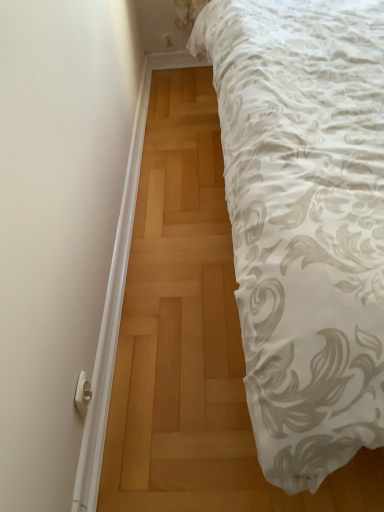
Question: Would you say white plastic door handle at lower left is to the left or to the right of white floral fabric at upper right in the picture?

Choices:
 (A) right
 (B) left

Answer: (B)

Question: Considering the positions of point (84, 391) and point (233, 182), is point (84, 391) closer or farther from the camera than point (233, 182)?

Choices:
 (A) closer
 (B) farther

Answer: (B)

Question: Relative to white floral fabric at upper right, is white plastic door handle at lower left in front or behind?

Choices:
 (A) behind
 (B) front

Answer: (A)

Question: Based on their sizes in the image, would you say white floral fabric at upper right is bigger or smaller than white plastic door handle at lower left?

Choices:
 (A) small
 (B) big

Answer: (B)

Question: Is white floral fabric at upper right in front of or behind white plastic door handle at lower left in the image?

Choices:
 (A) front
 (B) behind

Answer: (A)

Question: Is white floral fabric at upper right inside or outside of white plastic door handle at lower left?

Choices:
 (A) inside
 (B) outside

Answer: (B)

Question: Considering the positions of point (241, 117) and point (74, 401), is point (241, 117) closer or farther from the camera than point (74, 401)?

Choices:
 (A) closer
 (B) farther

Answer: (B)